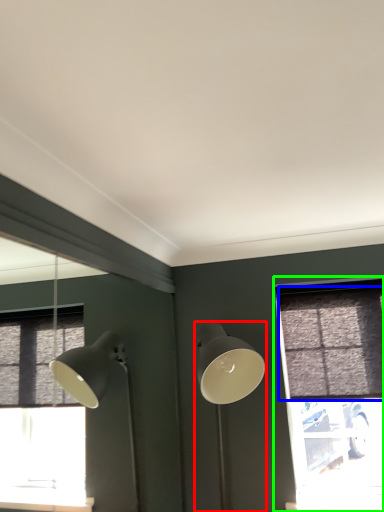
Question: Which object is the closest to the lamp (highlighted by a red box)? Choose among these: curtain (highlighted by a blue box) or window (highlighted by a green box).

Choices:
 (A) curtain
 (B) window

Answer: (A)